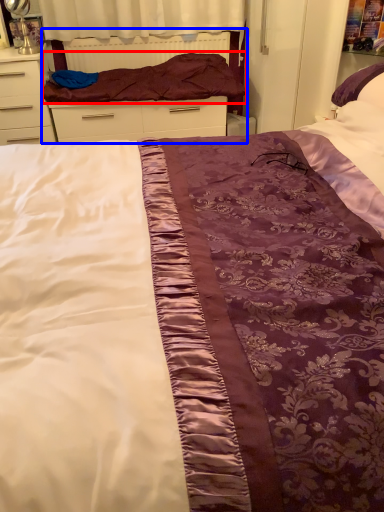
Question: Which object is further to the camera taking this photo, blanket (highlighted by a red box) or bed frame (highlighted by a blue box)?

Choices:
 (A) blanket
 (B) bed frame

Answer: (B)